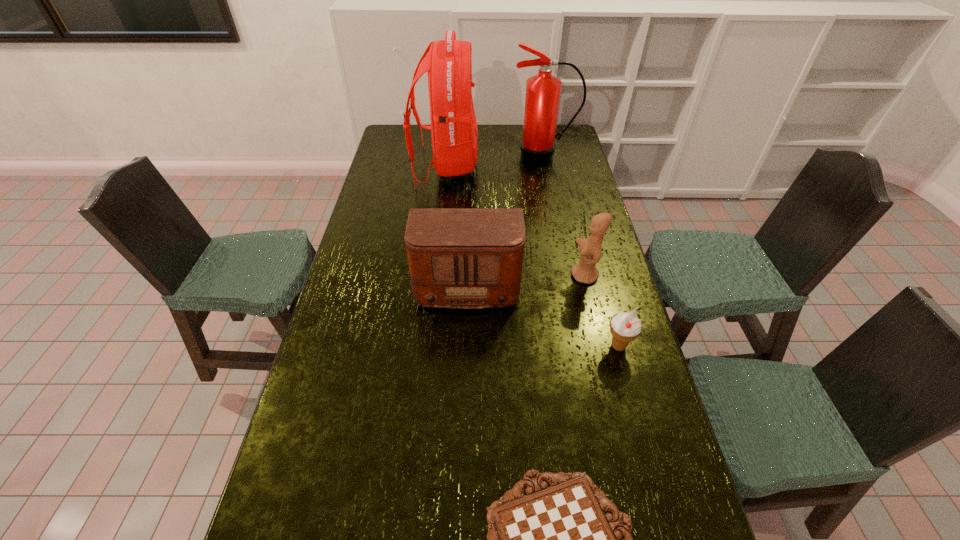
You are a GUI agent. You are given a task and a screenshot of the screen. Output one action in this format:
    pyautogui.click(x=<x>, y=<y>)
    Task: Click on the vacant space at the left edge of the desktop
    Image resolution: width=960 pixels, height=540 pixels.
    Given the screenshot: What is the action you would take?
    pyautogui.click(x=367, y=222)

Where is `vacant space at the right edge of the desktop`? vacant space at the right edge of the desktop is located at coordinates (578, 252).

I want to click on free spot at the far left corner of the desktop, so click(x=391, y=144).

The image size is (960, 540). Identify the location of free point between the second shortest object and the figurine. (602, 311).

Select which object appears as the third closest to the radio receiver. Please provide its 2D coordinates. Your answer should be formatted as a tuple, i.e. [(x, y)], where the tuple contains the x and y coordinates of a point satisfying the conditions above.

[(454, 132)]

Where is `object that is the closest to the fire extinguisher`? object that is the closest to the fire extinguisher is located at coordinates (454, 132).

This screenshot has width=960, height=540. I want to click on vacant space that satisfies the following two spatial constraints: 1. on the front-facing side of the figurine; 2. on the front panel of the radio receiver, so click(586, 280).

You are a GUI agent. You are given a task and a screenshot of the screen. Output one action in this format:
    pyautogui.click(x=<x>, y=<y>)
    Task: Click on the blank area in the image that satisfies the following two spatial constraints: 1. on the front-facing side of the figurine; 2. on the front panel of the radio receiver
    This screenshot has height=540, width=960.
    Given the screenshot: What is the action you would take?
    pyautogui.click(x=586, y=280)

Find the location of a particular element. The height and width of the screenshot is (540, 960). vacant region that satisfies the following two spatial constraints: 1. on the front-facing side of the figurine; 2. on the front panel of the radio receiver is located at coordinates (586, 280).

Image resolution: width=960 pixels, height=540 pixels. What are the coordinates of `vacant space that satisfies the following two spatial constraints: 1. on the main compartment of the backpack; 2. on the back side of the second shortest object` in the screenshot? It's located at (x=427, y=346).